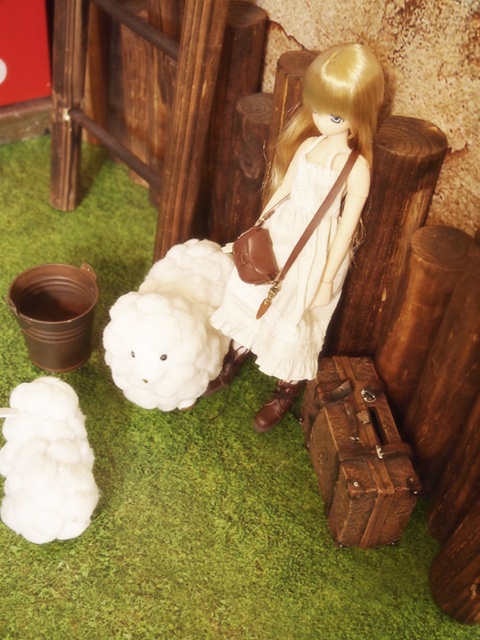
Question: Is rustic leather suitcase at lower right above white cotton dress at center?

Choices:
 (A) yes
 (B) no

Answer: (B)

Question: Which object is closer to the camera taking this photo?

Choices:
 (A) rustic leather suitcase at lower right
 (B) white fluffy lamb at lower left
 (C) white fluffy toy at lower left
 (D) white cotton dress at center

Answer: (D)

Question: Which point is farther to the camera?

Choices:
 (A) (12, 522)
 (B) (377, 497)
 (C) (191, 285)

Answer: (C)

Question: Observing the image, what is the correct spatial positioning of rustic leather suitcase at lower right in reference to white fluffy toy at lower left?

Choices:
 (A) left
 (B) right

Answer: (B)

Question: Among these points, which one is nearest to the camera?

Choices:
 (A) click(35, 513)
 (B) click(330, 420)
 (C) click(148, 310)
 (D) click(300, 346)

Answer: (A)

Question: Does white fluffy lamb at lower left have a lesser width compared to white cotton dress at center?

Choices:
 (A) no
 (B) yes

Answer: (B)